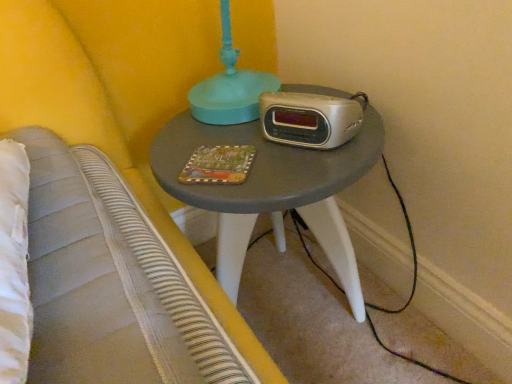
Question: Does silver metallic clock radio at center appear on the right side of matte painted wood book at center?

Choices:
 (A) no
 (B) yes

Answer: (B)

Question: Is silver metallic clock radio at center next to matte painted wood book at center and touching it?

Choices:
 (A) no
 (B) yes

Answer: (A)

Question: Does silver metallic clock radio at center lie in front of matte painted wood book at center?

Choices:
 (A) yes
 (B) no

Answer: (A)

Question: Is silver metallic clock radio at center positioned with its back to matte painted wood book at center?

Choices:
 (A) yes
 (B) no

Answer: (B)

Question: Would you say silver metallic clock radio at center contains matte painted wood book at center?

Choices:
 (A) yes
 (B) no

Answer: (B)

Question: Is point (242, 145) closer or farther from the camera than point (355, 132)?

Choices:
 (A) closer
 (B) farther

Answer: (B)

Question: Considering their positions, is matte painted wood book at center located in front of or behind silver metallic clock radio at center?

Choices:
 (A) front
 (B) behind

Answer: (B)

Question: From their relative heights in the image, would you say matte painted wood book at center is taller or shorter than silver metallic clock radio at center?

Choices:
 (A) short
 (B) tall

Answer: (A)

Question: Would you say matte painted wood book at center is inside or outside silver metallic clock radio at center?

Choices:
 (A) inside
 (B) outside

Answer: (B)

Question: Considering the positions of point (229, 157) and point (353, 274), is point (229, 157) closer or farther from the camera than point (353, 274)?

Choices:
 (A) farther
 (B) closer

Answer: (B)

Question: From the image's perspective, is matte painted wood book at center positioned above or below matte gray table at center?

Choices:
 (A) below
 (B) above

Answer: (B)

Question: Looking at their shapes, would you say matte painted wood book at center is wider or thinner than matte gray table at center?

Choices:
 (A) wide
 (B) thin

Answer: (B)

Question: In terms of size, does matte painted wood book at center appear bigger or smaller than matte gray table at center?

Choices:
 (A) small
 (B) big

Answer: (A)

Question: Do you think silver metallic clock radio at center is within matte painted wood book at center, or outside of it?

Choices:
 (A) inside
 (B) outside

Answer: (B)

Question: Considering the positions of silver metallic clock radio at center and matte painted wood book at center in the image, is silver metallic clock radio at center wider or thinner than matte painted wood book at center?

Choices:
 (A) thin
 (B) wide

Answer: (A)